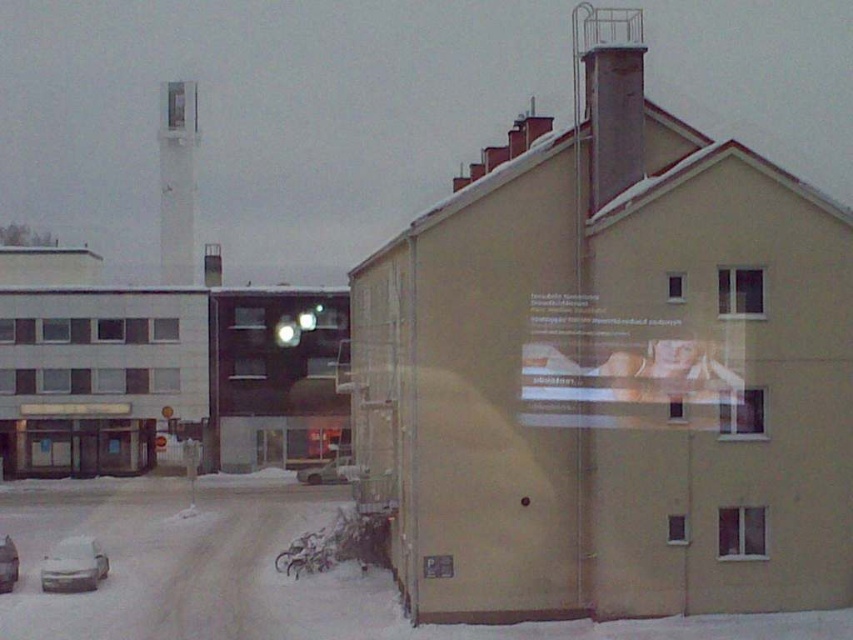
You are a delivery driver who needs to park your vehicle in this area. You have a white matte car at lower left and a silver metallic car at lower left blocking your path. Which car is positioned more to the right, potentially obstructing your access?

The white matte car at lower left is positioned to the right of the silver metallic car at lower left, so it is the one more to the right and might be obstructing access.

You are a delivery person trying to park your silver metallic car at lower left near the white glossy chimney at upper left. Can you estimate whether the space between them is large enough for your car to maneuver?

The white glossy chimney at upper left is bigger than the silver metallic car at lower left. However, the size comparison does not provide information about the available space between them. You would need to assess the actual distance or clearance between the two objects to determine if there is enough room for maneuvering the car.

You are standing in front of the beige building and want to place a new poster next to the white glossy chimney at upper left. Based on the coordinates provided, where should you position the new poster?

The white glossy chimney at upper left is located at point (177, 182), so you should position the new poster near those coordinates to place it next to the chimney.